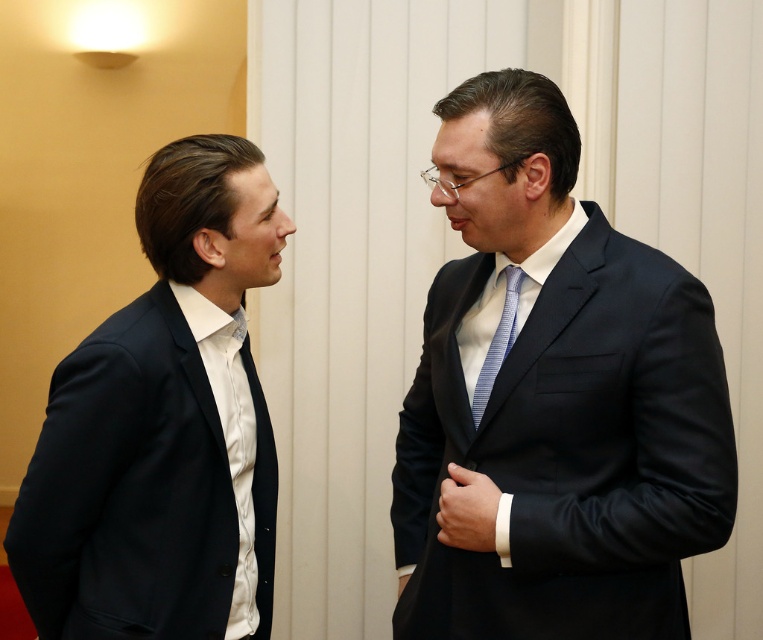
Question: Can you confirm if matte black suit at right is positioned to the left of matte black suit at left?

Choices:
 (A) yes
 (B) no

Answer: (B)

Question: Is matte black suit at right wider than blue striped tie at center?

Choices:
 (A) no
 (B) yes

Answer: (B)

Question: Which point is farther to the camera?

Choices:
 (A) blue striped tie at center
 (B) matte black suit at right

Answer: (A)

Question: Which of the following is the closest to the observer?

Choices:
 (A) (153, 579)
 (B) (506, 288)

Answer: (A)

Question: Is matte black suit at right to the left of matte black suit at left from the viewer's perspective?

Choices:
 (A) yes
 (B) no

Answer: (B)

Question: Which point is closer to the camera?

Choices:
 (A) blue striped tie at center
 (B) matte black suit at left
 (C) matte black suit at right

Answer: (C)